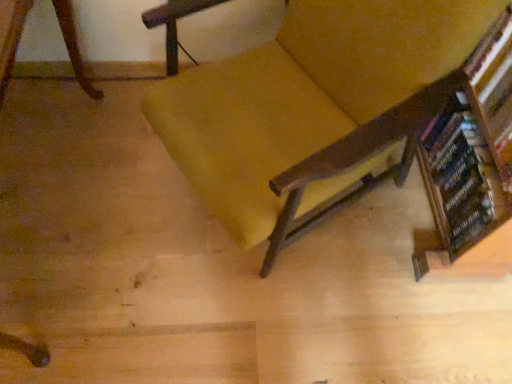
Question: From a real-world perspective, is wooden bookshelf at right located beneath velvet yellow chair at center?

Choices:
 (A) yes
 (B) no

Answer: (B)

Question: From a real-world perspective, is wooden bookshelf at right located higher than velvet yellow chair at center?

Choices:
 (A) yes
 (B) no

Answer: (A)

Question: From the image's perspective, is wooden bookshelf at right on velvet yellow chair at center?

Choices:
 (A) no
 (B) yes

Answer: (B)

Question: Is velvet yellow chair at center at the back of wooden bookshelf at right?

Choices:
 (A) yes
 (B) no

Answer: (B)

Question: Is wooden bookshelf at right outside of velvet yellow chair at center?

Choices:
 (A) yes
 (B) no

Answer: (A)

Question: Is wooden bookcase at right inside or outside of velvet yellow chair at center?

Choices:
 (A) inside
 (B) outside

Answer: (B)

Question: Is point (468, 84) positioned closer to the camera than point (292, 11)?

Choices:
 (A) farther
 (B) closer

Answer: (B)

Question: In terms of width, does wooden bookcase at right look wider or thinner when compared to velvet yellow chair at center?

Choices:
 (A) wide
 (B) thin

Answer: (B)

Question: Considering the positions of wooden bookcase at right and velvet yellow chair at center in the image, is wooden bookcase at right taller or shorter than velvet yellow chair at center?

Choices:
 (A) tall
 (B) short

Answer: (B)

Question: Would you say velvet yellow chair at center is to the left or to the right of wooden bookcase at right in the picture?

Choices:
 (A) right
 (B) left

Answer: (B)

Question: From the image's perspective, relative to wooden bookcase at right, is velvet yellow chair at center above or below?

Choices:
 (A) below
 (B) above

Answer: (B)

Question: Do you think velvet yellow chair at center is within wooden bookcase at right, or outside of it?

Choices:
 (A) inside
 (B) outside

Answer: (B)

Question: From a real-world perspective, is velvet yellow chair at center above or below wooden bookcase at right?

Choices:
 (A) above
 (B) below

Answer: (A)

Question: Is wooden bookshelf at right wider or thinner than velvet yellow chair at center?

Choices:
 (A) wide
 (B) thin

Answer: (B)

Question: Considering their positions, is wooden bookshelf at right located in front of or behind velvet yellow chair at center?

Choices:
 (A) behind
 (B) front

Answer: (A)